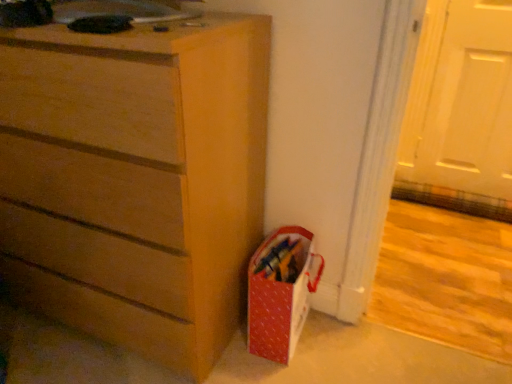
Question: Is matte red gift bag at lower right behind matte wood chest of drawers at center?

Choices:
 (A) yes
 (B) no

Answer: (A)

Question: Can you confirm if matte red gift bag at lower right is taller than matte wood chest of drawers at center?

Choices:
 (A) no
 (B) yes

Answer: (A)

Question: Does matte red gift bag at lower right have a smaller size compared to matte wood chest of drawers at center?

Choices:
 (A) yes
 (B) no

Answer: (A)

Question: Can you confirm if matte red gift bag at lower right is thinner than matte wood chest of drawers at center?

Choices:
 (A) no
 (B) yes

Answer: (B)

Question: Is matte red gift bag at lower right turned away from matte wood chest of drawers at center?

Choices:
 (A) yes
 (B) no

Answer: (B)

Question: Relative to matte red gift bag at lower right, is matte wood chest of drawers at center in front or behind?

Choices:
 (A) behind
 (B) front

Answer: (B)

Question: Considering the positions of matte wood chest of drawers at center and matte red gift bag at lower right in the image, is matte wood chest of drawers at center wider or thinner than matte red gift bag at lower right?

Choices:
 (A) wide
 (B) thin

Answer: (A)

Question: From the image's perspective, is matte wood chest of drawers at center positioned above or below matte red gift bag at lower right?

Choices:
 (A) above
 (B) below

Answer: (A)

Question: Is point (133, 340) closer or farther from the camera than point (273, 307)?

Choices:
 (A) farther
 (B) closer

Answer: (A)

Question: From the image's perspective, is matte wood chest of drawers at center located above or below white matte door at upper right?

Choices:
 (A) above
 (B) below

Answer: (B)

Question: Is matte wood chest of drawers at center bigger or smaller than white matte door at upper right?

Choices:
 (A) small
 (B) big

Answer: (B)

Question: In terms of height, does matte wood chest of drawers at center look taller or shorter compared to white matte door at upper right?

Choices:
 (A) tall
 (B) short

Answer: (A)

Question: In the image, is matte wood chest of drawers at center positioned in front of or behind white matte door at upper right?

Choices:
 (A) front
 (B) behind

Answer: (A)

Question: Considering the positions of white matte door at upper right and matte wood chest of drawers at center in the image, is white matte door at upper right wider or thinner than matte wood chest of drawers at center?

Choices:
 (A) thin
 (B) wide

Answer: (A)

Question: From a real-world perspective, is white matte door at upper right physically located above or below matte wood chest of drawers at center?

Choices:
 (A) below
 (B) above

Answer: (B)